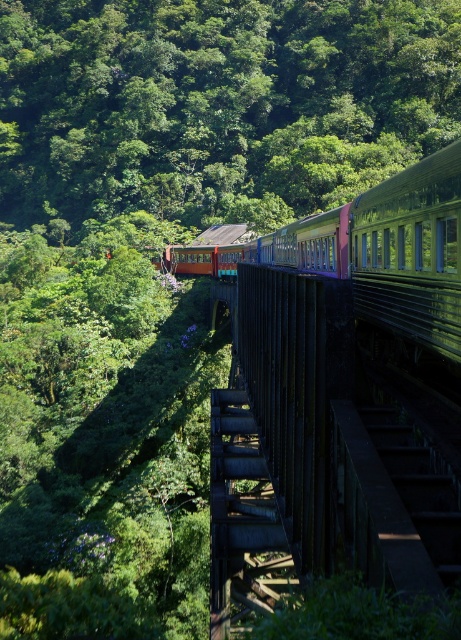
From the picture: Who is higher up, green leafy tree at upper center or dark brown wooden bridge at center?

Positioned higher is green leafy tree at upper center.

Who is more forward, (242,200) or (254,531)?

Point (254,531) is more forward.

The height and width of the screenshot is (640, 461). Find the location of `green leafy tree at upper center`. green leafy tree at upper center is located at coordinates click(218, 104).